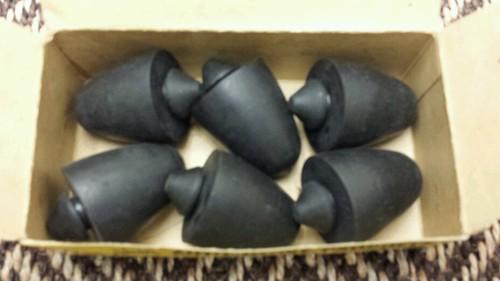
Where is `top of cardboard box`? The image size is (500, 281). top of cardboard box is located at coordinates (225, 41).